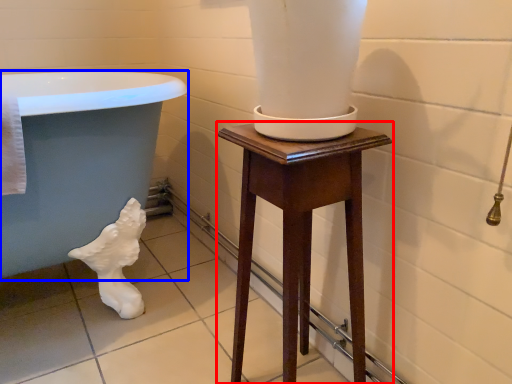
Question: Which object appears closest to the camera in this image, furniture (highlighted by a red box) or bath (highlighted by a blue box)?

Choices:
 (A) furniture
 (B) bath

Answer: (A)